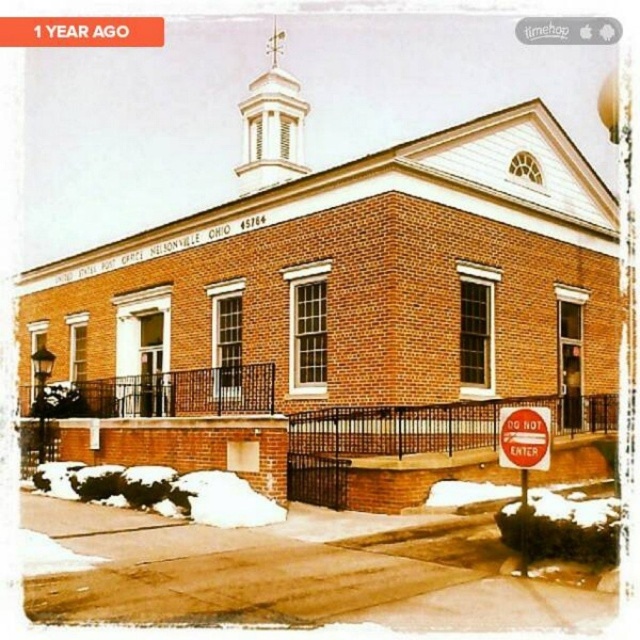
Question: Which point appears farthest from the camera in this image?

Choices:
 (A) (381, 68)
 (B) (260, 152)
 (C) (531, 429)
 (D) (532, 426)

Answer: (A)

Question: Estimate the real-world distances between objects in this image. Which object is closer to the red plastic sign at lower right?

Choices:
 (A) white smooth spire at upper center
 (B) red matte stop sign at lower right
 (C) brick building at center

Answer: (B)

Question: In this image, where is brick building at center located relative to red matte stop sign at lower right?

Choices:
 (A) below
 (B) above

Answer: (B)

Question: Can you confirm if brick building at center is positioned to the left of red matte stop sign at lower right?

Choices:
 (A) no
 (B) yes

Answer: (B)

Question: Which of the following is the farthest from the observer?

Choices:
 (A) (250, 125)
 (B) (509, 444)

Answer: (A)

Question: Is white smooth spire at upper center positioned behind red plastic sign at lower right?

Choices:
 (A) yes
 (B) no

Answer: (A)